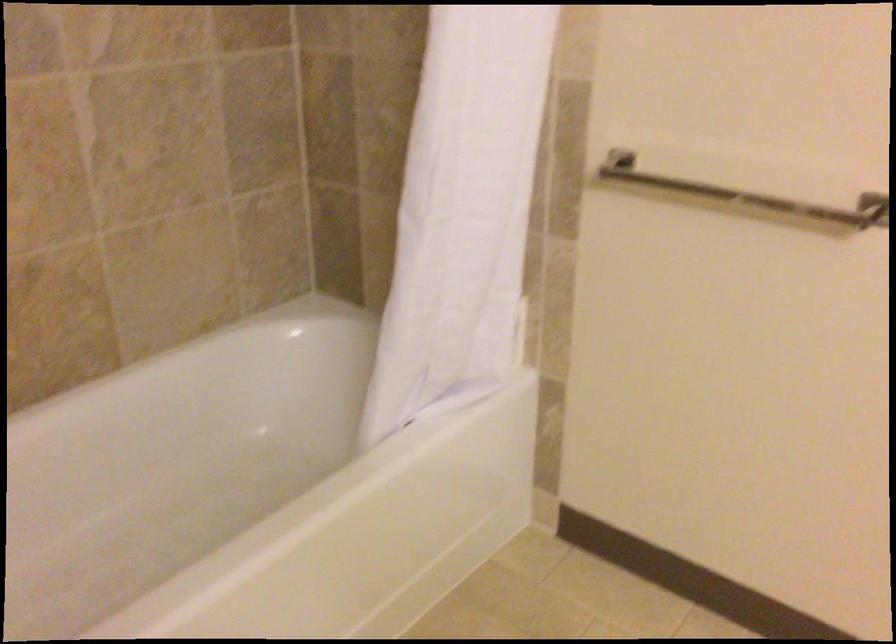
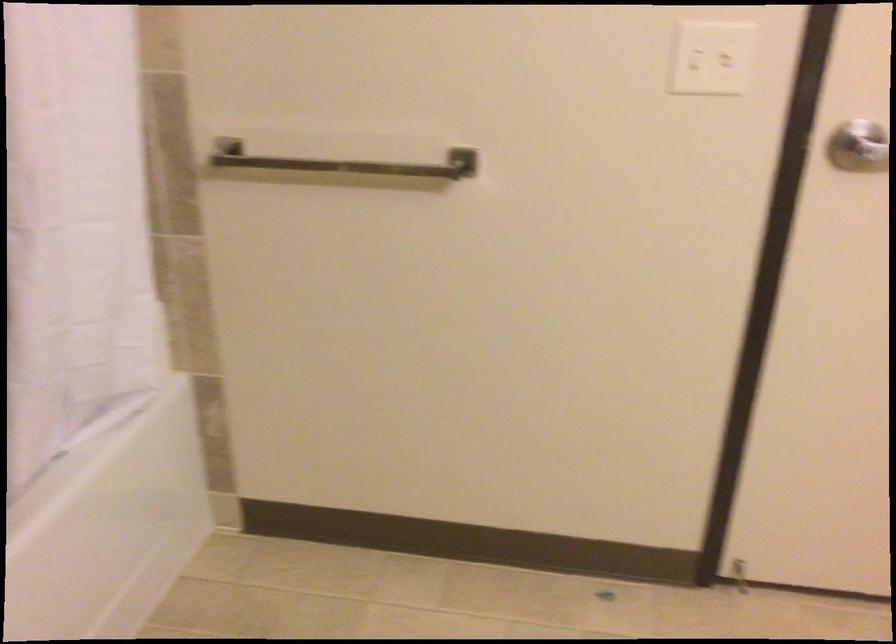
Which direction would the cameraman need to move to produce the second image?

The cameraman moved toward left, backward.